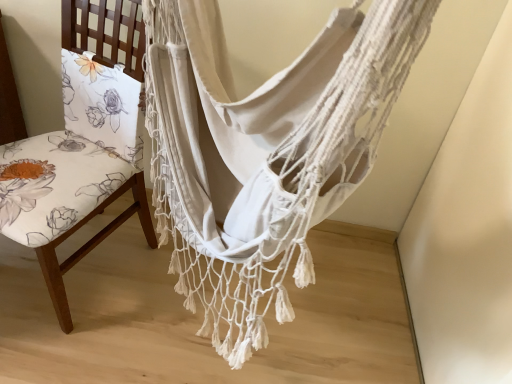
Question: Can you confirm if white woven hammock at center is bigger than floral fabric chair at left?

Choices:
 (A) yes
 (B) no

Answer: (A)

Question: Is white woven hammock at center next to floral fabric chair at left and touching it?

Choices:
 (A) yes
 (B) no

Answer: (B)

Question: Is white woven hammock at center completely or partially outside of floral fabric chair at left?

Choices:
 (A) no
 (B) yes

Answer: (B)

Question: Is white woven hammock at center positioned before floral fabric chair at left?

Choices:
 (A) yes
 (B) no

Answer: (A)

Question: Are white woven hammock at center and floral fabric chair at left far apart?

Choices:
 (A) yes
 (B) no

Answer: (B)

Question: From a real-world perspective, does white woven hammock at center stand above floral fabric chair at left?

Choices:
 (A) no
 (B) yes

Answer: (B)

Question: Is the position of floral fabric chair at left more distant than that of white woven hammock at center?

Choices:
 (A) yes
 (B) no

Answer: (A)

Question: Would you consider floral fabric chair at left to be distant from white woven hammock at center?

Choices:
 (A) no
 (B) yes

Answer: (A)

Question: Does floral fabric chair at left have a smaller size compared to white woven hammock at center?

Choices:
 (A) no
 (B) yes

Answer: (B)

Question: From the image's perspective, would you say floral fabric chair at left is positioned over white woven hammock at center?

Choices:
 (A) yes
 (B) no

Answer: (A)

Question: Could you tell me if floral fabric chair at left is facing white woven hammock at center?

Choices:
 (A) yes
 (B) no

Answer: (B)

Question: Does floral fabric chair at left have a larger size compared to white woven hammock at center?

Choices:
 (A) yes
 (B) no

Answer: (B)

Question: From the image's perspective, relative to white woven hammock at center, is floral fabric chair at left above or below?

Choices:
 (A) below
 (B) above

Answer: (B)